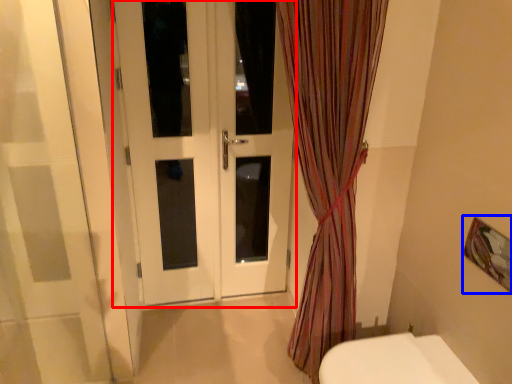
Question: Which point is closer to the camera, door (highlighted by a red box) or picture frame (highlighted by a blue box)?

Choices:
 (A) door
 (B) picture frame

Answer: (B)